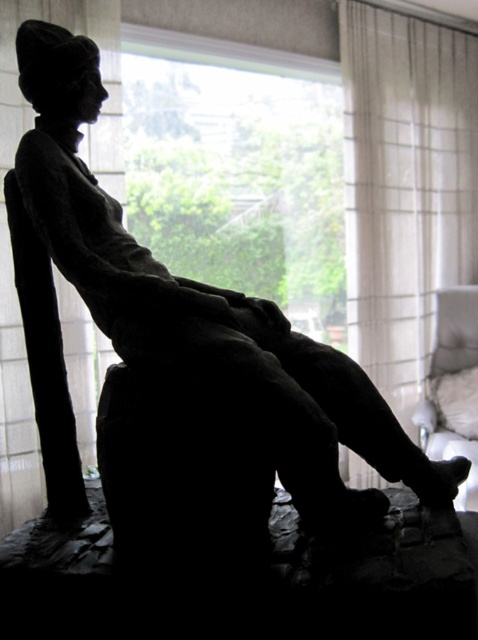
Question: Does transparent glass window at upper center have a greater width compared to white fabric armchair at right?

Choices:
 (A) yes
 (B) no

Answer: (A)

Question: Considering the relative positions of white sheer curtain at right and white fabric armchair at right in the image provided, where is white sheer curtain at right located with respect to white fabric armchair at right?

Choices:
 (A) above
 (B) below

Answer: (A)

Question: Observing the image, what is the correct spatial positioning of transparent glass window at upper center in reference to white sheer curtain at right?

Choices:
 (A) right
 (B) left

Answer: (B)

Question: Which point is farther to the camera?

Choices:
 (A) transparent glass window at upper center
 (B) white sheer curtain at right
 (C) white fabric armchair at right

Answer: (B)

Question: Among these points, which one is nearest to the camera?

Choices:
 (A) (451, 449)
 (B) (183, 38)

Answer: (B)

Question: Which is nearer to the white sheer curtain at right?

Choices:
 (A) transparent glass window at upper center
 (B) white fabric armchair at right

Answer: (A)